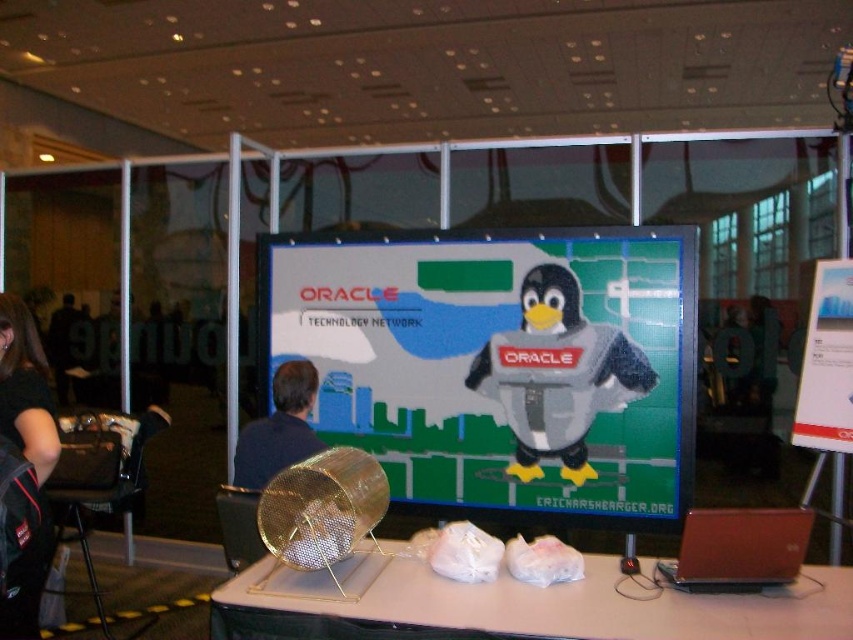
You are at the conference and need to place a large banner on the table. The banner requires a table positioned at coordinates between 0.9 and 0.65 on the x and y axes. Is the white plastic table at center suitable?

The white plastic table at center is located at point (527, 604), which falls within the required x and y coordinate range of 0.9 to 0.65. Therefore, the banner can be placed on the white plastic table at center.